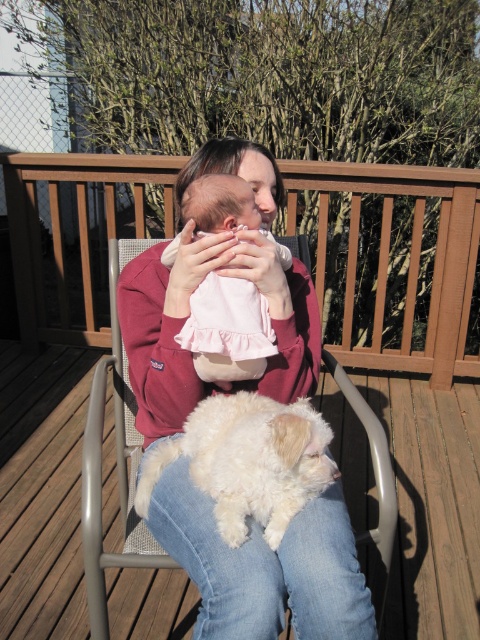
Question: Which object is positioned farthest from the metallic gray chair at center?

Choices:
 (A) pink satin baby at center
 (B) white fluffy dog at center

Answer: (A)

Question: Does white fluffy dog at center have a larger size compared to pink satin baby at center?

Choices:
 (A) yes
 (B) no

Answer: (A)

Question: Which of these objects is positioned farthest from the white fluffy dog at center?

Choices:
 (A) metallic gray chair at center
 (B) pink satin baby at center

Answer: (A)

Question: Which point appears closest to the camera in this image?

Choices:
 (A) (124, 518)
 (B) (256, 320)
 (C) (279, 435)

Answer: (C)

Question: Is metallic gray chair at center behind pink satin baby at center?

Choices:
 (A) yes
 (B) no

Answer: (B)

Question: Is white fluffy dog at center bigger than pink satin baby at center?

Choices:
 (A) no
 (B) yes

Answer: (B)